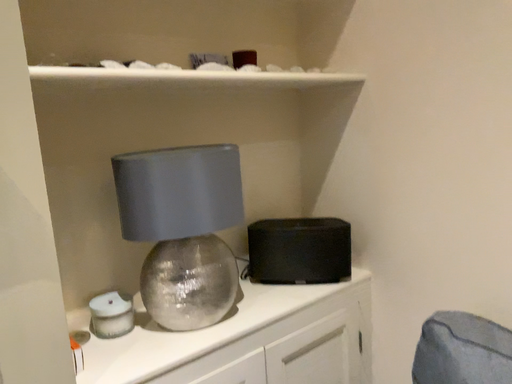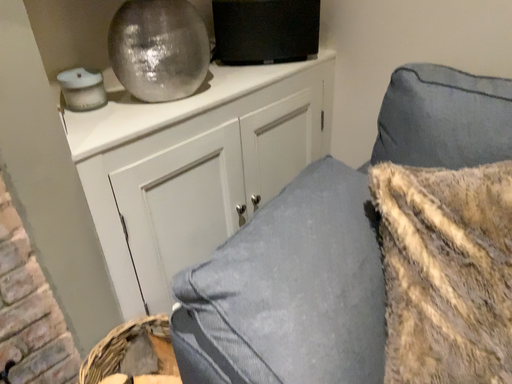
Question: How did the camera likely rotate when shooting the video?

Choices:
 (A) rotated upward
 (B) rotated downward

Answer: (B)